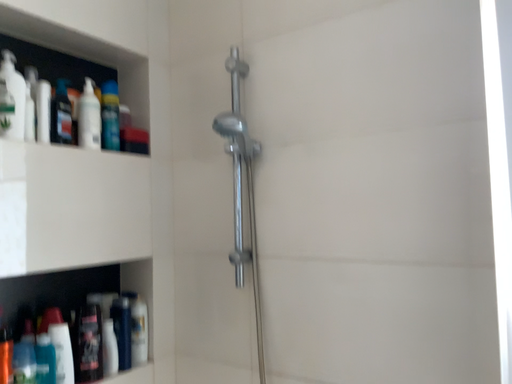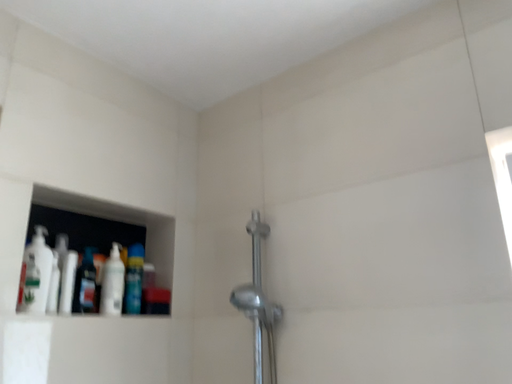
Question: Which way did the camera rotate in the video?

Choices:
 (A) rotated upward
 (B) rotated downward

Answer: (A)